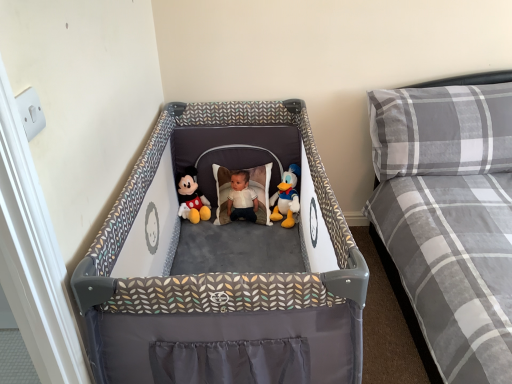
Question: From the image's perspective, is gray plaid pillow at upper right located above gray plaid mattress at right?

Choices:
 (A) no
 (B) yes

Answer: (B)

Question: Is gray plaid pillow at upper right positioned beyond the bounds of gray plaid mattress at right?

Choices:
 (A) yes
 (B) no

Answer: (B)

Question: Does gray plaid pillow at upper right come in front of gray plaid mattress at right?

Choices:
 (A) yes
 (B) no

Answer: (B)

Question: From the image's perspective, is gray plaid pillow at upper right located beneath gray plaid mattress at right?

Choices:
 (A) no
 (B) yes

Answer: (A)

Question: Can gray plaid mattress at right be found inside gray plaid pillow at upper right?

Choices:
 (A) yes
 (B) no

Answer: (B)

Question: Visually, is gray plaid pillow at upper right positioned to the left or to the right of matte plush mickey mouse at center, arranged as the 1th toy when viewed from the left?

Choices:
 (A) right
 (B) left

Answer: (A)

Question: Is point (390, 119) positioned closer to the camera than point (187, 193)?

Choices:
 (A) closer
 (B) farther

Answer: (A)

Question: Considering the positions of gray plaid pillow at upper right and matte plush mickey mouse at center, arranged as the 1th toy when viewed from the left, in the image, is gray plaid pillow at upper right bigger or smaller than matte plush mickey mouse at center, arranged as the 1th toy when viewed from the left,?

Choices:
 (A) big
 (B) small

Answer: (A)

Question: From their relative heights in the image, would you say gray plaid pillow at upper right is taller or shorter than matte plush mickey mouse at center, arranged as the 1th toy when viewed from the left?

Choices:
 (A) tall
 (B) short

Answer: (A)

Question: Is point (472, 91) positioned closer to the camera than point (295, 175)?

Choices:
 (A) closer
 (B) farther

Answer: (A)

Question: Is gray plaid pillow at upper right bigger or smaller than white plush duck at center, which appears as the 2th toy when viewed from the left?

Choices:
 (A) small
 (B) big

Answer: (B)

Question: From a real-world perspective, relative to white plush duck at center, which appears as the 2th toy when viewed from the left, is gray plaid pillow at upper right vertically above or below?

Choices:
 (A) above
 (B) below

Answer: (A)

Question: Considering the positions of gray plaid pillow at upper right and white plush duck at center, which appears as the 2th toy when viewed from the left, in the image, is gray plaid pillow at upper right taller or shorter than white plush duck at center, which appears as the 2th toy when viewed from the left,?

Choices:
 (A) short
 (B) tall

Answer: (B)

Question: From a real-world perspective, is gray plaid mattress at right positioned above or below gray plaid pillow at upper right?

Choices:
 (A) above
 (B) below

Answer: (B)

Question: Is gray plaid mattress at right to the left or to the right of gray plaid pillow at upper right in the image?

Choices:
 (A) right
 (B) left

Answer: (A)